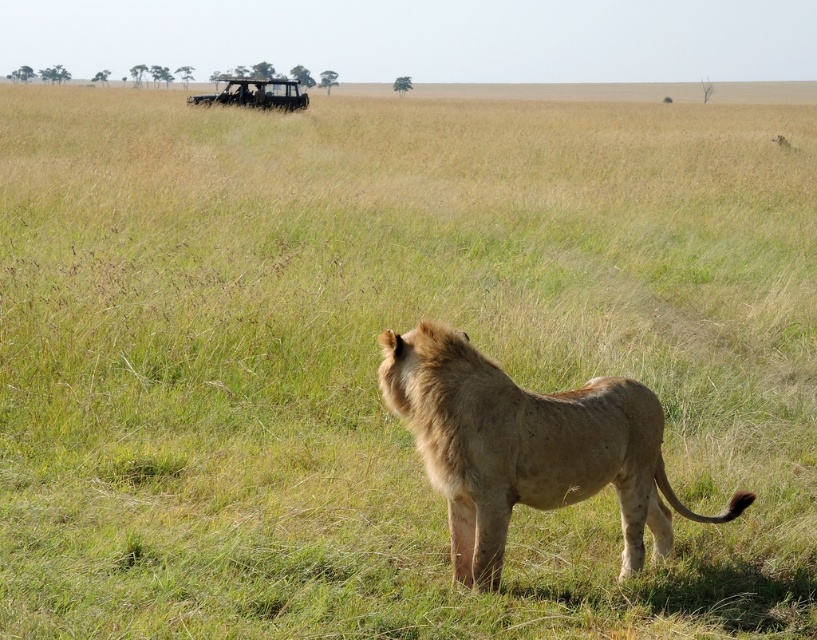
Is golden fur lion at center positioned behind metallic silver jeep at upper center?

No, it is not.

This screenshot has width=817, height=640. Describe the element at coordinates (525, 448) in the screenshot. I see `golden fur lion at center` at that location.

Identify the location of golden fur lion at center. This screenshot has width=817, height=640. (525, 448).

The height and width of the screenshot is (640, 817). Find the location of `golden fur lion at center`. golden fur lion at center is located at coordinates (525, 448).